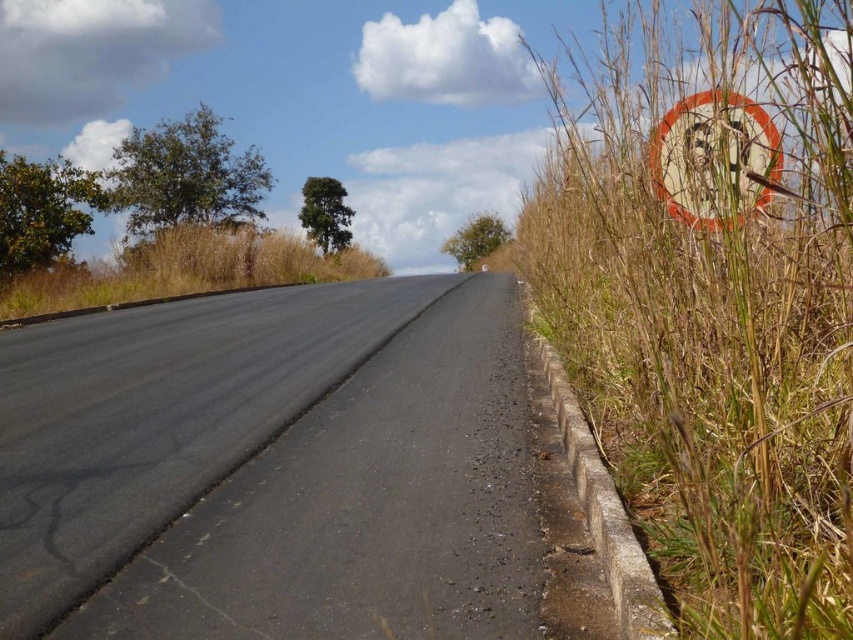
In the scene shown: Between brown dry grass at right and white plastic speed limit sign at right, which one is positioned lower?

white plastic speed limit sign at right is lower down.

Does brown dry grass at right have a greater width compared to white plastic speed limit sign at right?

Yes.

Which is behind, point (850, 38) or point (750, 152)?

Positioned behind is point (750, 152).

This screenshot has height=640, width=853. Identify the location of brown dry grass at right. (712, 298).

Looking at this image, between brown dry grass at right and dry grass at left, which one appears on the left side from the viewer's perspective?

dry grass at left

Does brown dry grass at right have a greater width compared to dry grass at left?

→ Yes, brown dry grass at right is wider than dry grass at left.

Is point (780, 305) positioned before point (287, 275)?

Yes, it is.

Identify the location of brown dry grass at right. This screenshot has width=853, height=640. (712, 298).

Does point (73, 272) come behind point (756, 106)?

Yes, it is behind point (756, 106).

Between dry grass at left and white plastic speed limit sign at right, which one has more height?

dry grass at left

This screenshot has height=640, width=853. Identify the location of dry grass at left. (184, 269).